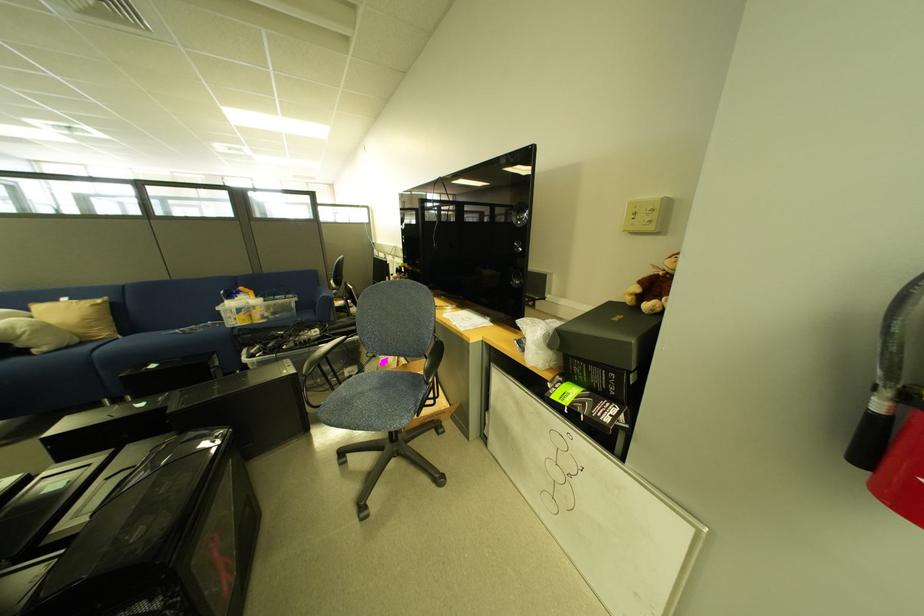
Find where to resting arm the black chair armrest. Please return your answer as a coordinate pair (x, y).

(322, 354)